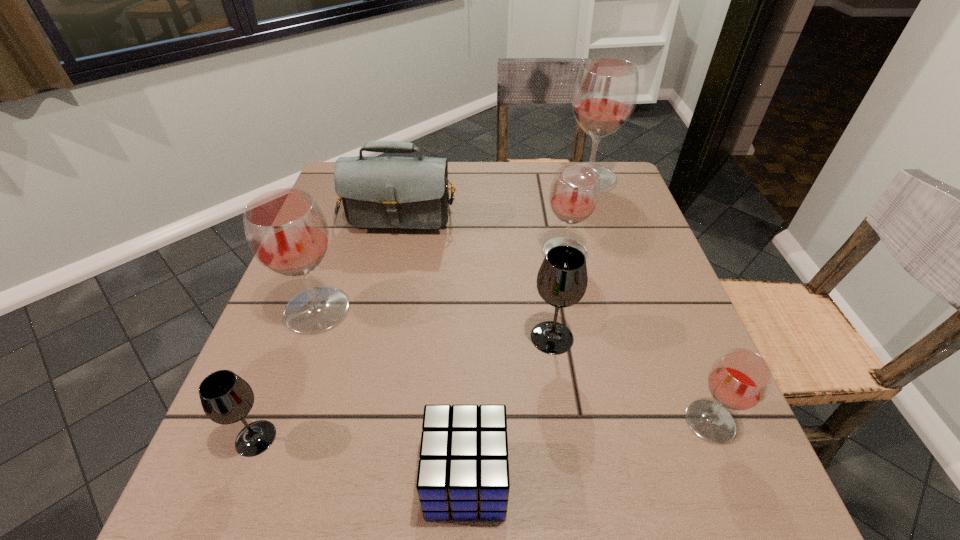
Locate an element on the screen. This screenshot has height=540, width=960. vacant space at the left edge is located at coordinates (324, 407).

The height and width of the screenshot is (540, 960). In the image, there is a desktop. In order to click on vacant space at the right edge in this screenshot , I will do `click(666, 330)`.

Find the location of a particular element. This screenshot has width=960, height=540. free space at the far left corner of the desktop is located at coordinates (338, 199).

The width and height of the screenshot is (960, 540). I want to click on vacant area at the near left corner of the desktop, so pyautogui.click(x=253, y=482).

The height and width of the screenshot is (540, 960). Find the location of `vacant area that lies between the left gray wineglass and the farthest wineglass`. vacant area that lies between the left gray wineglass and the farthest wineglass is located at coordinates (422, 308).

Where is `vacant point located between the tallest object and the cube`? This screenshot has height=540, width=960. vacant point located between the tallest object and the cube is located at coordinates (527, 329).

The width and height of the screenshot is (960, 540). In order to click on free space between the third smallest red wineglass and the fifth nearest wineglass in this screenshot , I will do `click(441, 281)`.

Find the location of a particular element. The height and width of the screenshot is (540, 960). empty location between the third smallest red wineglass and the nearest red wineglass is located at coordinates (514, 366).

At what (x,y) coordinates should I click in order to perform the action: click on free point between the cube and the shoulder bag. Please return your answer as a coordinate pair (x, y). Looking at the image, I should click on pyautogui.click(x=434, y=339).

Identify the location of free point between the second tallest object and the nearest red wineglass. (514, 366).